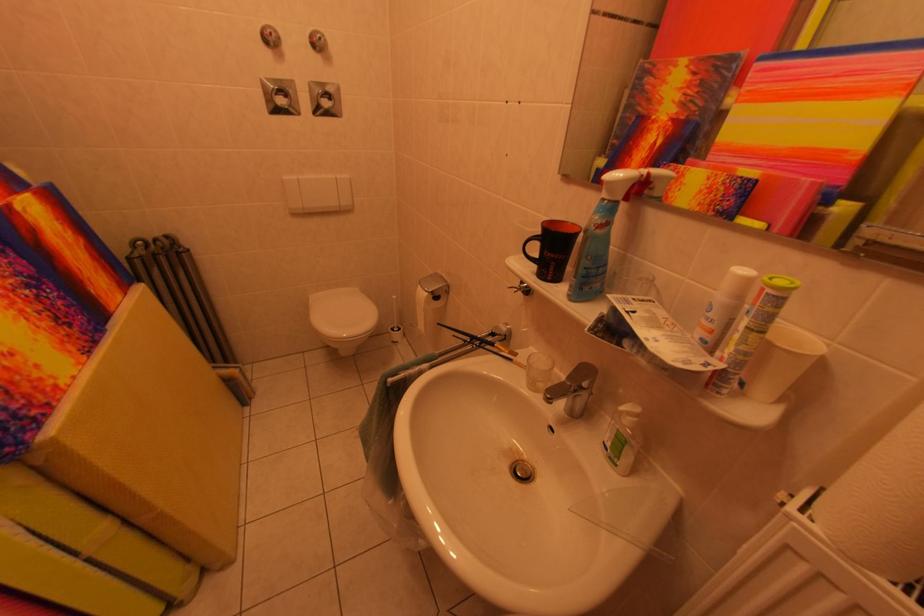
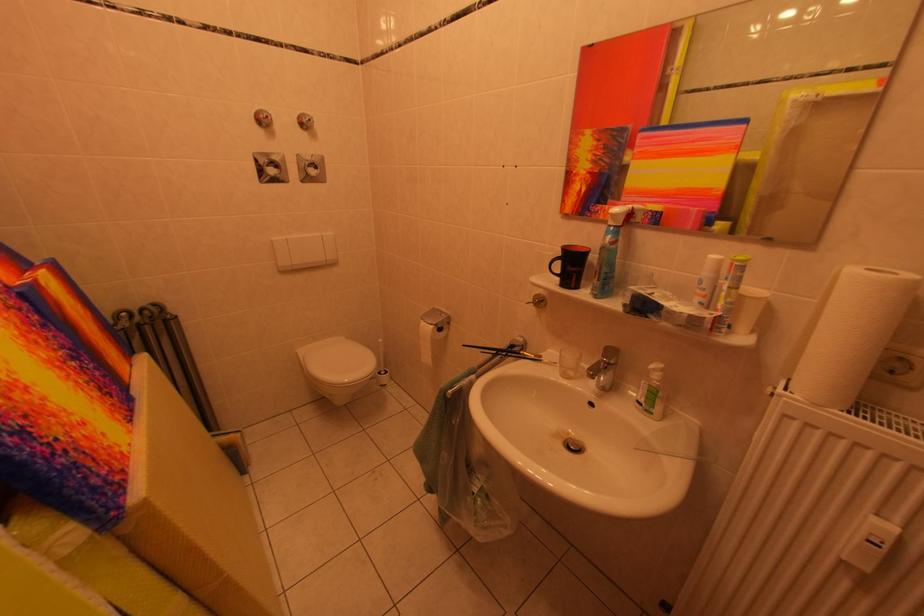
Where in the second image is the point corresponding to point (525, 294) from the first image?

(541, 308)